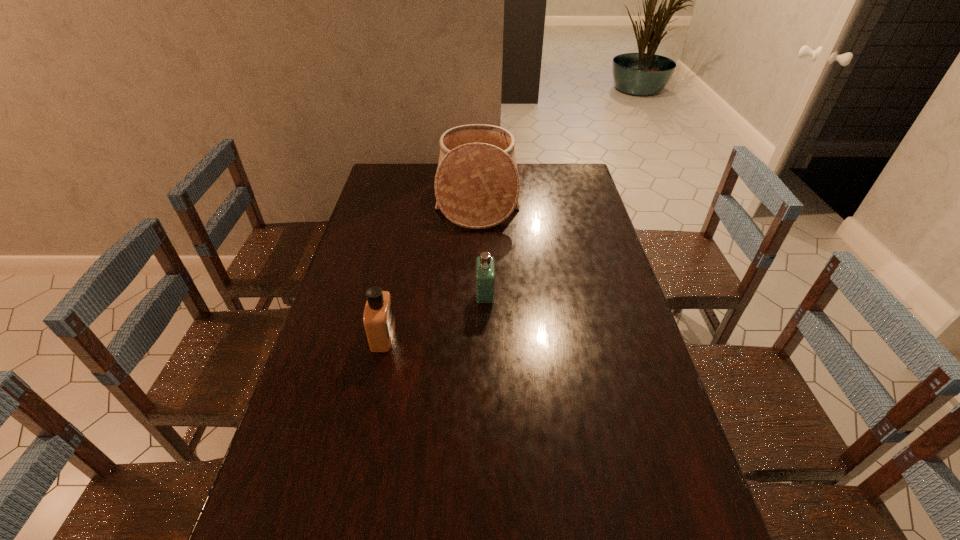
The width and height of the screenshot is (960, 540). What are the coordinates of `vacant space that's between the nearer perfume and the basket` in the screenshot? It's located at (430, 266).

At what (x,y) coordinates should I click in order to perform the action: click on free space between the left perfume and the farthest object. Please return your answer as a coordinate pair (x, y). The height and width of the screenshot is (540, 960). Looking at the image, I should click on (430, 266).

Identify the location of free space between the nearest object and the right perfume. (434, 316).

At what (x,y) coordinates should I click in order to perform the action: click on free point between the second nearest object and the leftmost object. Please return your answer as a coordinate pair (x, y). Looking at the image, I should click on (434, 316).

Image resolution: width=960 pixels, height=540 pixels. Identify the location of empty location between the farthest object and the left perfume. (430, 266).

Identify the location of vacant space that is in between the right perfume and the basket. (481, 247).

Identify the location of vacant point located between the basket and the second nearest object. This screenshot has height=540, width=960. (481, 247).

What are the coordinates of `object that is the second closest to the basket` in the screenshot? It's located at (378, 317).

Identify which object is located as the nearest to the left perfume. Please provide its 2D coordinates. Your answer should be formatted as a tuple, i.e. [(x, y)], where the tuple contains the x and y coordinates of a point satisfying the conditions above.

[(485, 271)]